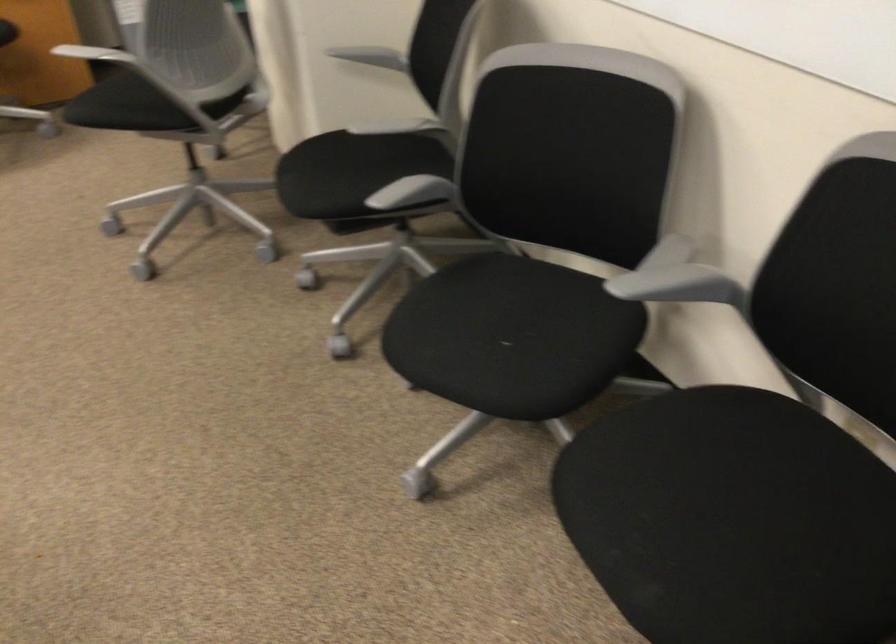
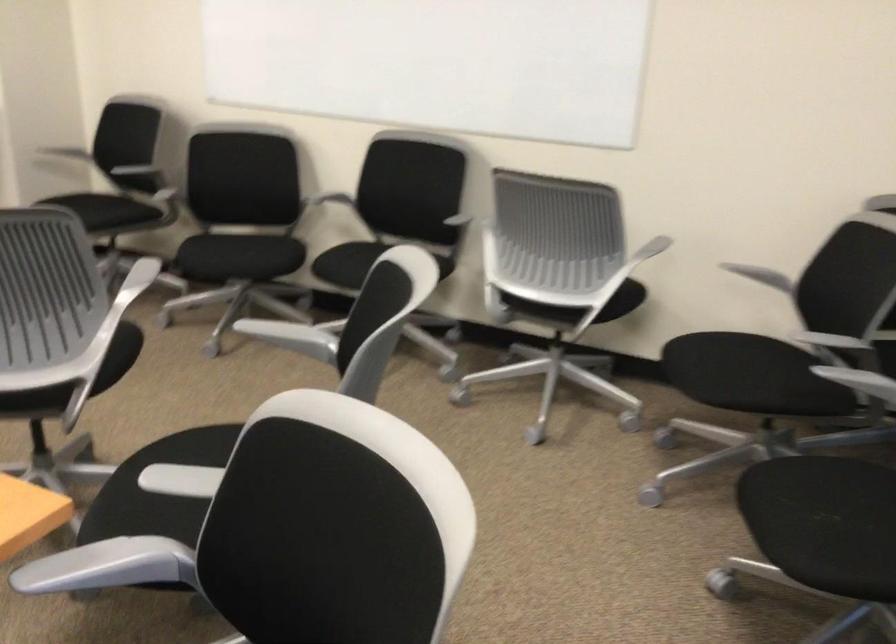
Where in the second image is the point corresponding to the point at 702,287 from the first image?

(340, 196)